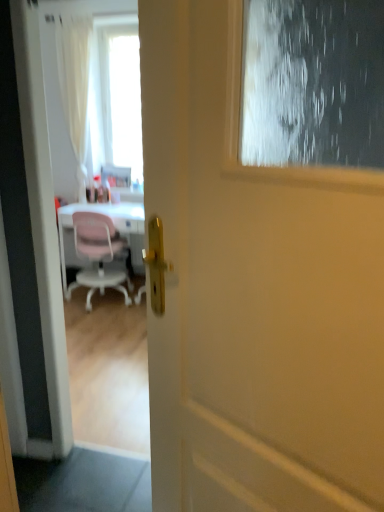
Question: Can you confirm if white matte door at center is bigger than transparent glass screen door at upper center?

Choices:
 (A) yes
 (B) no

Answer: (B)

Question: From a real-world perspective, is white matte door at center physically below transparent glass screen door at upper center?

Choices:
 (A) no
 (B) yes

Answer: (A)

Question: Can you confirm if white matte door at center is taller than transparent glass screen door at upper center?

Choices:
 (A) no
 (B) yes

Answer: (A)

Question: From the image's perspective, would you say white matte door at center is positioned over transparent glass screen door at upper center?

Choices:
 (A) yes
 (B) no

Answer: (B)

Question: From a real-world perspective, is white matte door at center on transparent glass screen door at upper center?

Choices:
 (A) no
 (B) yes

Answer: (B)

Question: Is white matte door at center beside transparent glass screen door at upper center?

Choices:
 (A) no
 (B) yes

Answer: (A)

Question: Can you confirm if pink plastic chair at left is wider than white matte door at center?

Choices:
 (A) yes
 (B) no

Answer: (A)

Question: Considering the relative sizes of pink plastic chair at left and white matte door at center in the image provided, is pink plastic chair at left taller than white matte door at center?

Choices:
 (A) yes
 (B) no

Answer: (B)

Question: From a real-world perspective, is pink plastic chair at left located beneath white matte door at center?

Choices:
 (A) no
 (B) yes

Answer: (B)

Question: Is white matte door at center a part of pink plastic chair at left?

Choices:
 (A) no
 (B) yes

Answer: (A)

Question: Considering the relative positions of pink plastic chair at left and white matte door at center in the image provided, is pink plastic chair at left to the left of white matte door at center from the viewer's perspective?

Choices:
 (A) no
 (B) yes

Answer: (B)

Question: Is pink plastic chair at left oriented away from white matte door at center?

Choices:
 (A) yes
 (B) no

Answer: (B)

Question: Could you tell me if pink plastic chair at left is turned towards transparent glass screen door at upper center?

Choices:
 (A) yes
 (B) no

Answer: (B)